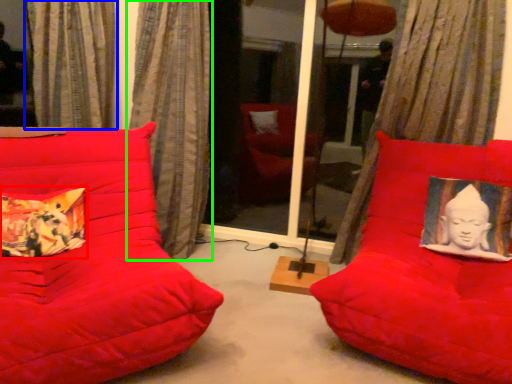
Question: Which is nearer to the pillow (highlighted by a red box)? curtain (highlighted by a blue box) or curtain (highlighted by a green box).

Choices:
 (A) curtain
 (B) curtain

Answer: (B)